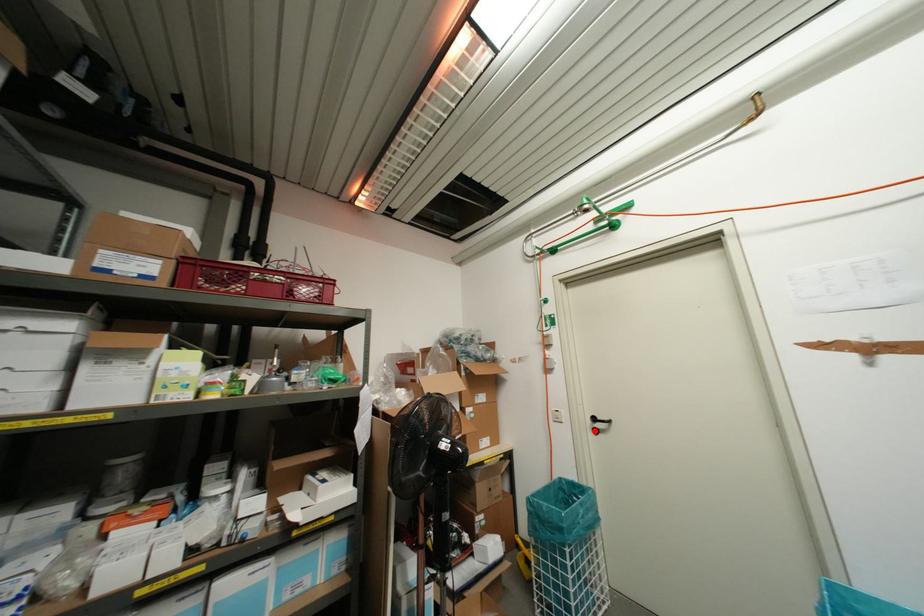
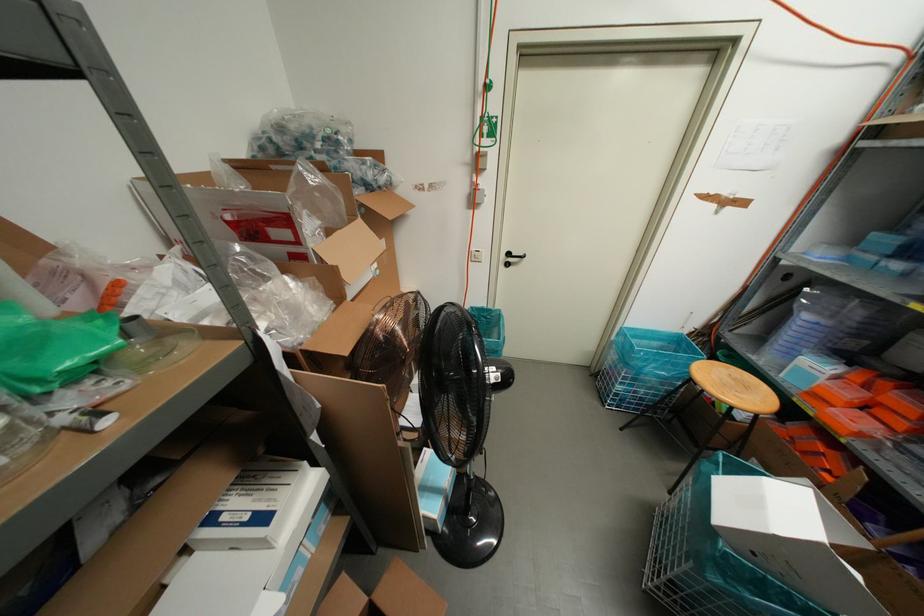
Where in the second image is the point corresponding to the highlighted location from the first image?

(506, 264)